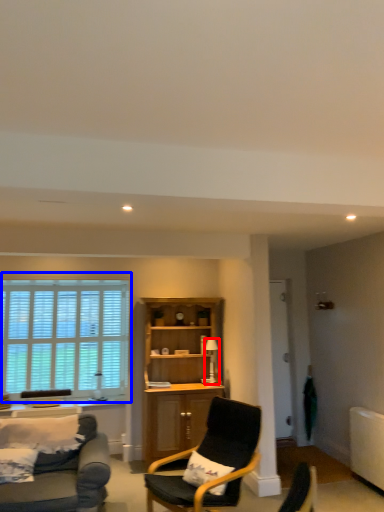
Question: Which object is further to the camera taking this photo, lamp (highlighted by a red box) or window (highlighted by a blue box)?

Choices:
 (A) lamp
 (B) window

Answer: (B)